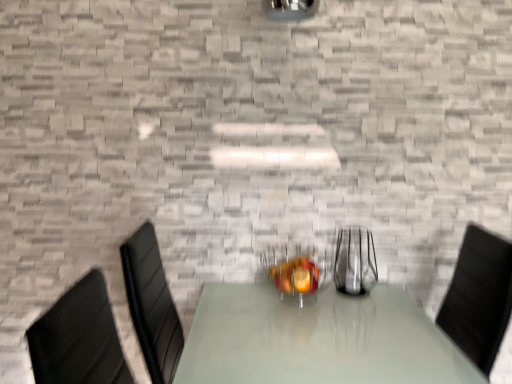
Question: Which direction should I rotate to look at metallic silver fruit bowl at center, positioned as the first tableware in left-to-right order, — up or down?

Choices:
 (A) up
 (B) down

Answer: (B)

Question: Is clear glass vase at center, which is the second tableware from left to right, inside metallic silver fruit bowl at center, positioned as the first tableware in left-to-right order?

Choices:
 (A) yes
 (B) no

Answer: (B)

Question: Can you confirm if metallic silver fruit bowl at center, placed as the 2th tableware when sorted from right to left, is positioned to the right of clear glass vase at center, the first tableware from the right?

Choices:
 (A) yes
 (B) no

Answer: (B)

Question: Considering the relative sizes of metallic silver fruit bowl at center, positioned as the first tableware in left-to-right order, and clear glass vase at center, the first tableware from the right, in the image provided, is metallic silver fruit bowl at center, positioned as the first tableware in left-to-right order, taller than clear glass vase at center, the first tableware from the right,?

Choices:
 (A) yes
 (B) no

Answer: (B)

Question: From the image's perspective, is metallic silver fruit bowl at center, placed as the 2th tableware when sorted from right to left, on top of clear glass vase at center, which is the second tableware from left to right?

Choices:
 (A) yes
 (B) no

Answer: (B)

Question: Is metallic silver fruit bowl at center, placed as the 2th tableware when sorted from right to left, oriented towards clear glass vase at center, the first tableware from the right?

Choices:
 (A) yes
 (B) no

Answer: (B)

Question: Is metallic silver fruit bowl at center, positioned as the first tableware in left-to-right order, positioned before clear glass vase at center, which is the second tableware from left to right?

Choices:
 (A) no
 (B) yes

Answer: (B)

Question: Considering the relative sizes of clear glass vase at center, which is the second tableware from left to right, and metallic silver fruit bowl at center, positioned as the first tableware in left-to-right order, in the image provided, is clear glass vase at center, which is the second tableware from left to right, smaller than metallic silver fruit bowl at center, positioned as the first tableware in left-to-right order,?

Choices:
 (A) yes
 (B) no

Answer: (A)

Question: Is metallic silver fruit bowl at center, positioned as the first tableware in left-to-right order, inside clear glass vase at center, which is the second tableware from left to right?

Choices:
 (A) yes
 (B) no

Answer: (B)

Question: From a real-world perspective, is clear glass vase at center, which is the second tableware from left to right, over metallic silver fruit bowl at center, positioned as the first tableware in left-to-right order?

Choices:
 (A) yes
 (B) no

Answer: (A)

Question: Can you confirm if clear glass vase at center, the first tableware from the right, is thinner than metallic silver fruit bowl at center, placed as the 2th tableware when sorted from right to left?

Choices:
 (A) no
 (B) yes

Answer: (B)

Question: Is clear glass vase at center, which is the second tableware from left to right, next to metallic silver fruit bowl at center, placed as the 2th tableware when sorted from right to left?

Choices:
 (A) yes
 (B) no

Answer: (B)

Question: Can you confirm if clear glass vase at center, the first tableware from the right, is taller than metallic silver fruit bowl at center, positioned as the first tableware in left-to-right order?

Choices:
 (A) yes
 (B) no

Answer: (A)

Question: Considering the relative positions of clear glass vase at center, the first tableware from the right, and metallic silver fruit bowl at center, placed as the 2th tableware when sorted from right to left, in the image provided, is clear glass vase at center, the first tableware from the right, to the left or to the right of metallic silver fruit bowl at center, placed as the 2th tableware when sorted from right to left,?

Choices:
 (A) right
 (B) left

Answer: (A)